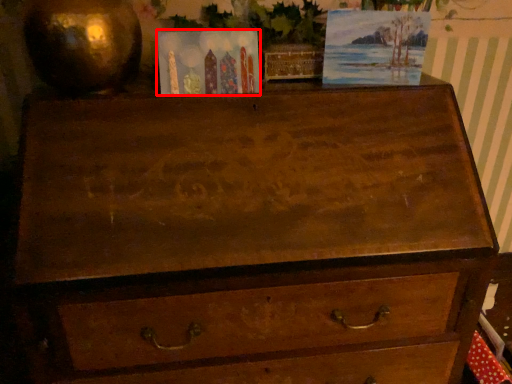
Question: Where is postcard (annotated by the red box) located in relation to picture frame in the image?

Choices:
 (A) right
 (B) left

Answer: (B)